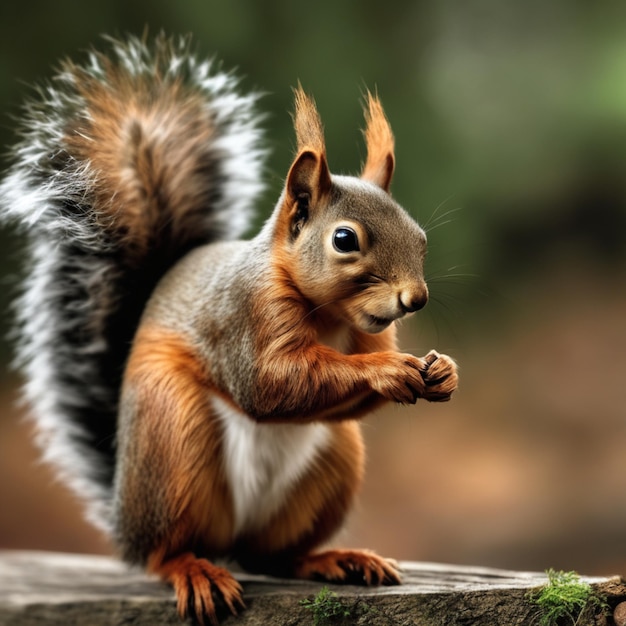
At what (x,y) coordinates should I click in order to perform the action: click on small green plants. Please return your answer as a coordinate pair (x, y). Image resolution: width=626 pixels, height=626 pixels. Looking at the image, I should click on (558, 592), (327, 608).